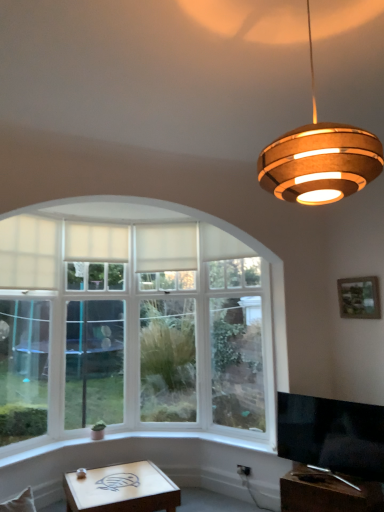
Question: Which direction should I rotate to look at white fabric curtain at center, marked as the first curtain in a right-to-left arrangement?

Choices:
 (A) right
 (B) left

Answer: (B)

Question: Does wooden picture frame at upper right have a larger size compared to clear glass door at center?

Choices:
 (A) yes
 (B) no

Answer: (B)

Question: From the image's perspective, would you say wooden picture frame at upper right is shown under clear glass door at center?

Choices:
 (A) yes
 (B) no

Answer: (B)

Question: Considering the relative sizes of wooden picture frame at upper right and clear glass door at center in the image provided, is wooden picture frame at upper right smaller than clear glass door at center?

Choices:
 (A) yes
 (B) no

Answer: (A)

Question: Can you confirm if wooden picture frame at upper right is positioned to the left of clear glass door at center?

Choices:
 (A) yes
 (B) no

Answer: (B)

Question: Is wooden picture frame at upper right thinner than clear glass door at center?

Choices:
 (A) no
 (B) yes

Answer: (B)

Question: From a real-world perspective, is wooden picture frame at upper right under clear glass door at center?

Choices:
 (A) no
 (B) yes

Answer: (A)

Question: Can you confirm if white fabric curtain at upper left, which appears as the 1th curtain when viewed from the left, is smaller than clear glass door at center?

Choices:
 (A) no
 (B) yes

Answer: (B)

Question: Can you confirm if white fabric curtain at upper left, which appears as the second curtain when viewed from the right, is positioned to the right of clear glass door at center?

Choices:
 (A) no
 (B) yes

Answer: (B)

Question: Is white fabric curtain at upper left, which appears as the second curtain when viewed from the right, facing away from clear glass door at center?

Choices:
 (A) no
 (B) yes

Answer: (B)

Question: From the image's perspective, would you say white fabric curtain at upper left, which appears as the 1th curtain when viewed from the left, is positioned over clear glass door at center?

Choices:
 (A) yes
 (B) no

Answer: (A)

Question: From the image's perspective, is white fabric curtain at upper left, which appears as the 1th curtain when viewed from the left, beneath clear glass door at center?

Choices:
 (A) no
 (B) yes

Answer: (A)

Question: From a real-world perspective, is white fabric curtain at upper left, which appears as the 1th curtain when viewed from the left, physically above clear glass door at center?

Choices:
 (A) no
 (B) yes

Answer: (B)

Question: Is black glossy tv at lower right smaller than wooden picture frame at upper right?

Choices:
 (A) no
 (B) yes

Answer: (A)